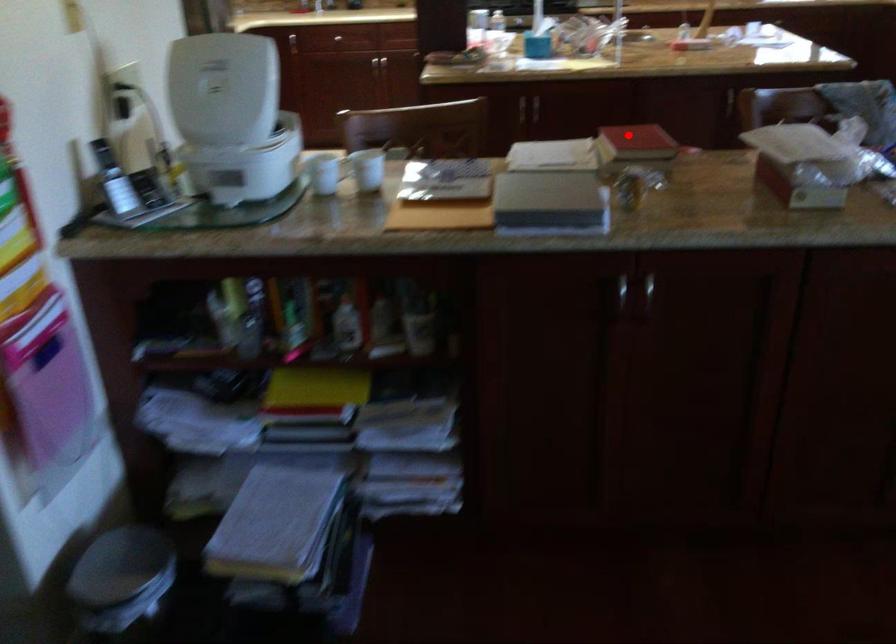
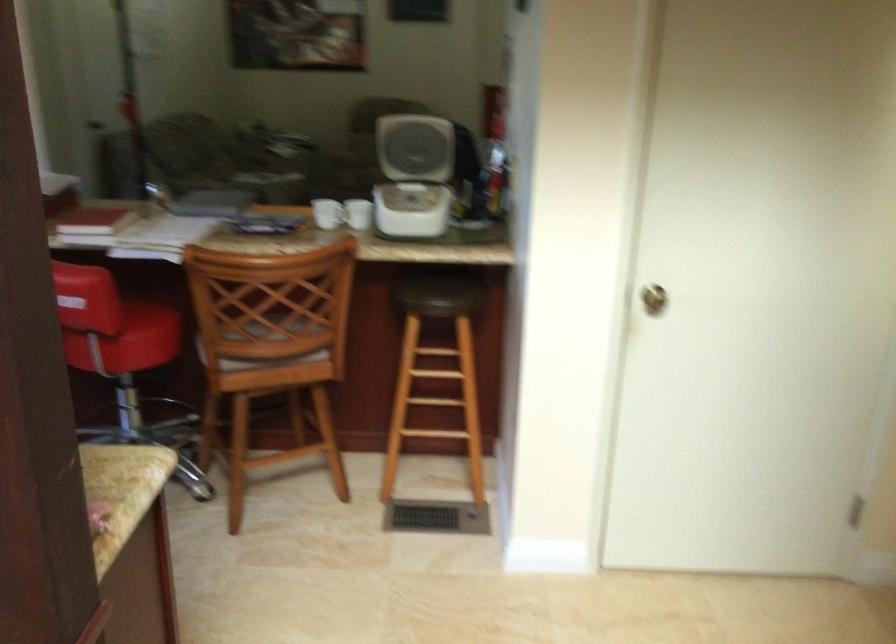
Locate, in the second image, the point that corresponds to the highlighted location in the first image.

(93, 223)